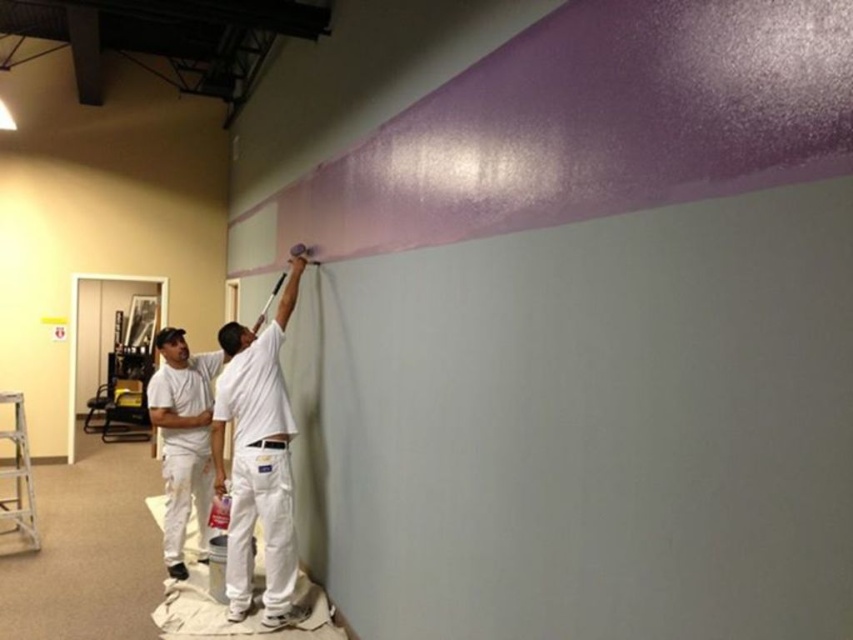
Question: Which object is farther from the camera taking this photo?

Choices:
 (A) aluminum metallic ladder at lower left
 (B) white matte paint at lower left

Answer: (A)

Question: Is white matte paint at lower left to the right of aluminum metallic ladder at lower left from the viewer's perspective?

Choices:
 (A) yes
 (B) no

Answer: (A)

Question: Which object appears closest to the camera in this image?

Choices:
 (A) aluminum metallic ladder at lower left
 (B) white matte shirt at upper center

Answer: (B)

Question: Among these objects, which one is nearest to the camera?

Choices:
 (A) white matte shirt at upper center
 (B) white matte paint at lower left
 (C) aluminum metallic ladder at lower left

Answer: (A)

Question: Is white matte shirt at upper center wider than aluminum metallic ladder at lower left?

Choices:
 (A) yes
 (B) no

Answer: (B)

Question: Does white matte shirt at upper center appear on the left side of aluminum metallic ladder at lower left?

Choices:
 (A) yes
 (B) no

Answer: (B)